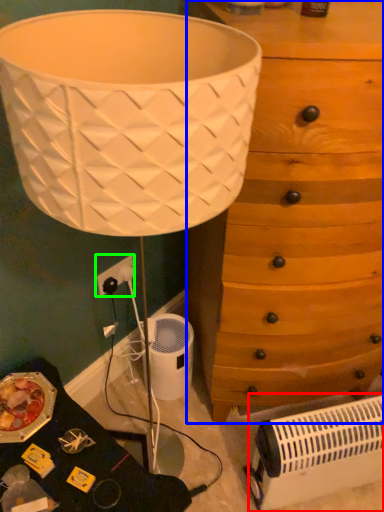
Question: Which object is the closest to the heater (highlighted by a red box)? Choose among these: chest of drawers (highlighted by a blue box) or electric outlet (highlighted by a green box).

Choices:
 (A) chest of drawers
 (B) electric outlet

Answer: (A)